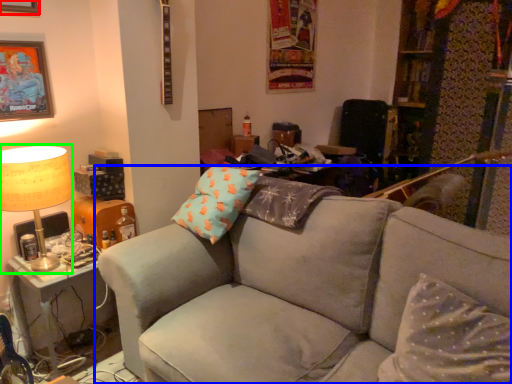
Question: Based on their relative distances, which object is farther from picture frame (highlighted by a red box)? Choose from studio couch (highlighted by a blue box) and table lamp (highlighted by a green box).

Choices:
 (A) studio couch
 (B) table lamp

Answer: (A)